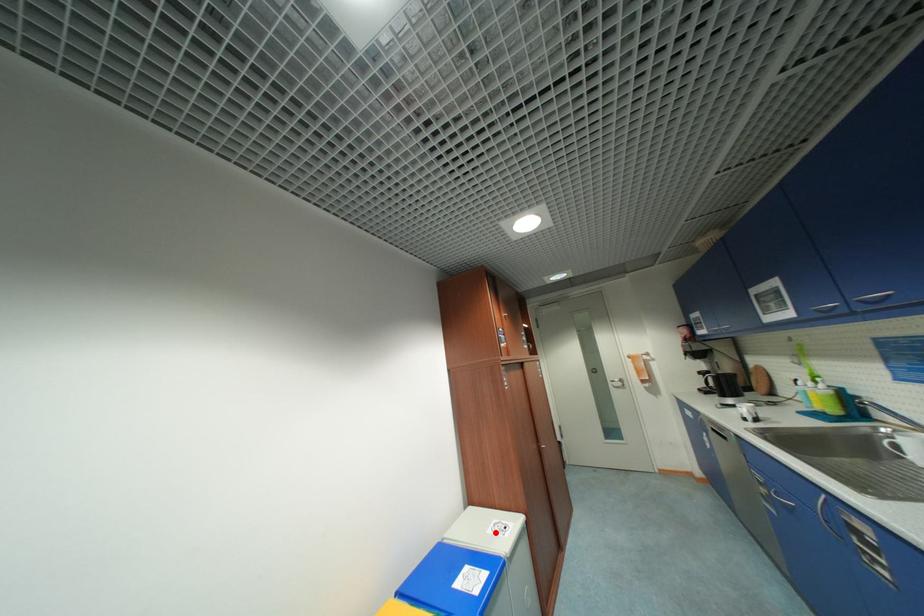
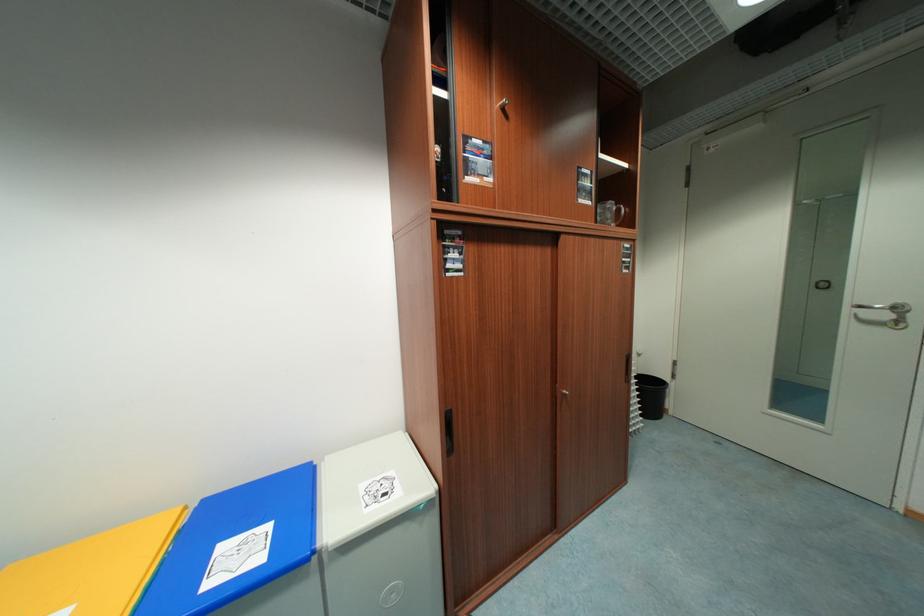
The point at the highlighted location is marked in the first image. Where is the corresponding point in the second image?

(369, 488)